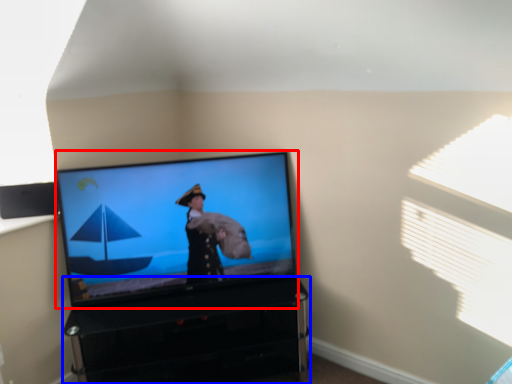
Question: Which of the following is the closest to the observer, television (highlighted by a red box) or furniture (highlighted by a blue box)?

Choices:
 (A) television
 (B) furniture

Answer: (B)